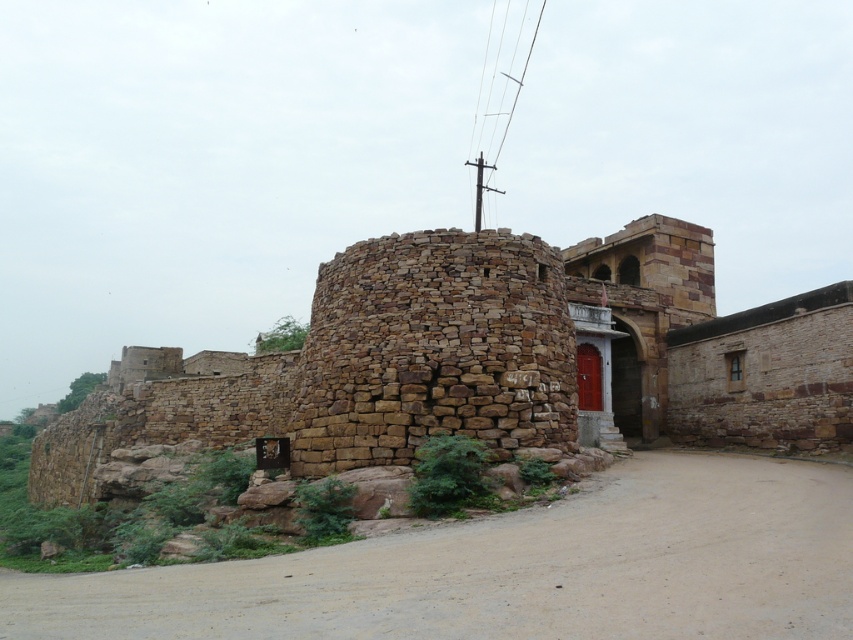
Looking at this image, you are a traveler approaching the brown stone fort at center and the brown sandy dirt track at center. Which one is located to the left side from your perspective?

The brown stone fort at center is located to the left of the brown sandy dirt track at center, so it would be on your left side as you approach them.

You are a surveyor tasked with mapping the coordinates of historical structures. You have a device that can only pinpoint locations within a 0.5 radius. Is the brown stone fort at center within this range?

The brown stone fort at center is located at point (486,360), which is within the 0.5 radius since both coordinates are less than 0.5 apart from the origin. Therefore, the device can pinpoint its location.

You are a traveler approaching the brown stone fort at center and the brown sandy dirt track at center. Which one do you see first as you get closer?

The brown stone fort at center is bigger than the brown sandy dirt track at center, so you would see the brown stone fort at center first as you approach because larger objects become visible before smaller ones at a distance.